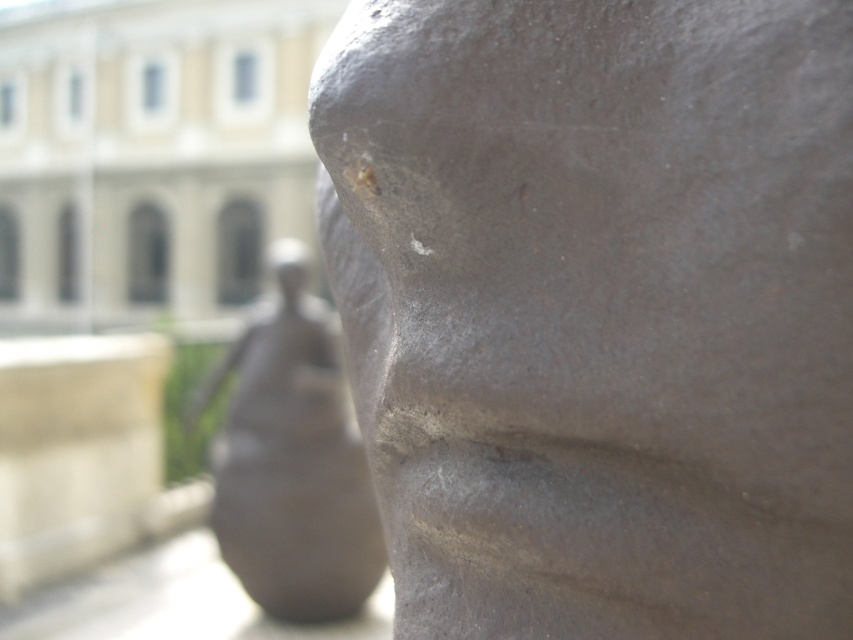
Is matte gray stone face at center smaller than matte bronze head at center?

Answer: Yes.

Is point (604, 580) farther from viewer compared to point (283, 291)?

No, it is not.

Is point (412, 480) positioned in front of point (302, 243)?

Yes, it is in front of point (302, 243).

Find the location of a particular element. Image resolution: width=853 pixels, height=640 pixels. matte gray stone face at center is located at coordinates (598, 308).

Between matte gray stone face at center and matte gray stone statue at center, which one appears on the right side from the viewer's perspective?

matte gray stone face at center is more to the right.

Who is lower down, matte gray stone face at center or matte gray stone statue at center?

matte gray stone statue at center is lower down.

Find the location of a particular element. matte gray stone face at center is located at coordinates (598, 308).

Who is taller, matte gray stone statue at center or matte bronze head at center?

matte gray stone statue at center is taller.

Between point (268, 340) and point (293, 256), which one is positioned behind?

Positioned behind is point (293, 256).

Measure the distance between matte gray stone statue at center and camera.

matte gray stone statue at center is 4.72 meters away from camera.

Where is `matte gray stone statue at center`? Image resolution: width=853 pixels, height=640 pixels. matte gray stone statue at center is located at coordinates (291, 468).